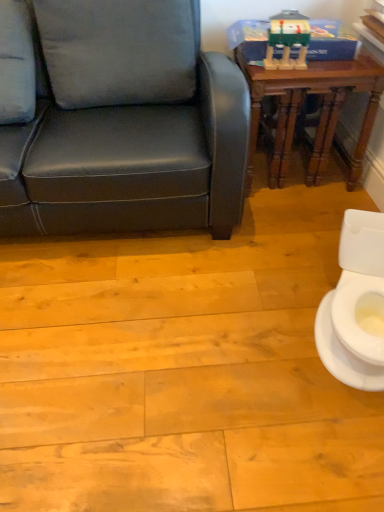
Identify the location of free space below white glossy toilet at lower right (from a real-world perspective). This screenshot has height=512, width=384. [x=318, y=330].